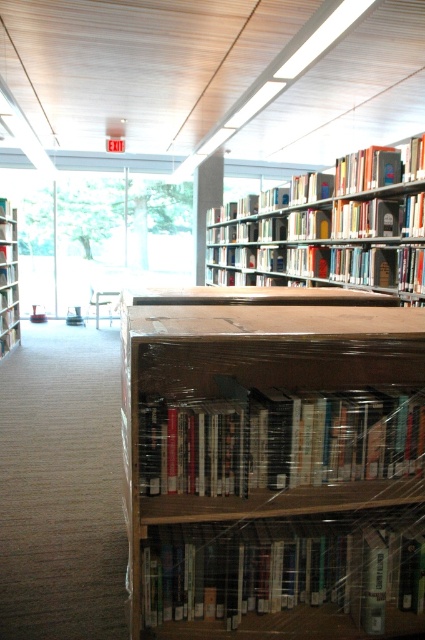
Does matte plastic books at center come in front of hardcover book at center?

Yes, it is.

Consider the image. Can you confirm if matte plastic books at center is wider than hardcover book at center?

Indeed, matte plastic books at center has a greater width compared to hardcover book at center.

Who is more forward, (x=251, y=488) or (x=416, y=141)?

Positioned in front is point (x=251, y=488).

The image size is (425, 640). I want to click on matte plastic books at center, so click(x=278, y=440).

Between point (384, 440) and point (297, 433), which one is positioned in front?

Point (297, 433) is in front.

Which of these two, clear plastic bookshelf at center or matte plastic books at center, stands taller?

clear plastic bookshelf at center

Between point (206, 406) and point (402, 465), which one is positioned in front?

Point (206, 406) is in front.

Locate an element on the screen. Image resolution: width=425 pixels, height=640 pixels. clear plastic bookshelf at center is located at coordinates point(272,464).

Does point (156, 477) come closer to viewer compared to point (393, 150)?

Yes, it is.

Identify the location of clear plastic bookshelf at center. pos(272,464).